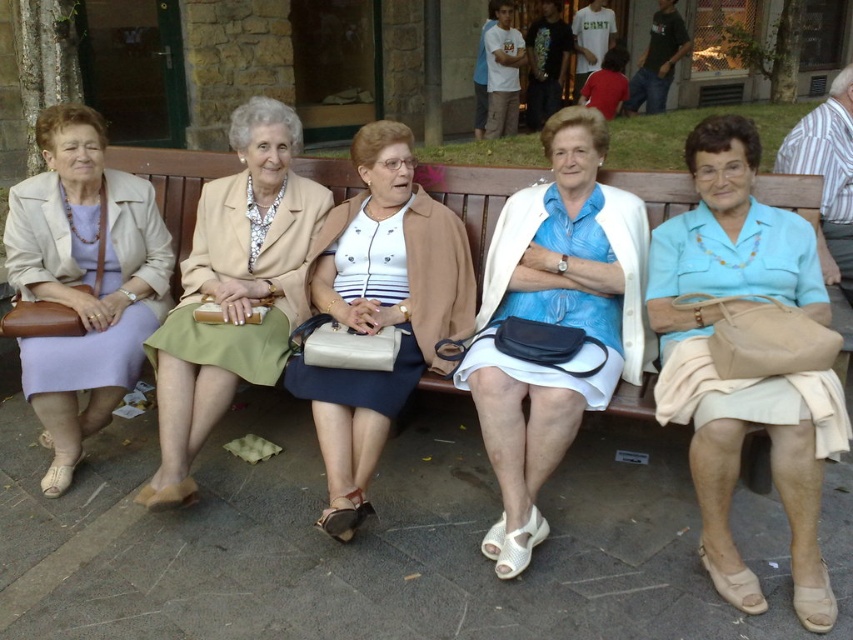
Question: Which point appears farthest from the camera in this image?

Choices:
 (A) (631, 344)
 (B) (169, 440)

Answer: (A)

Question: Which point appears farthest from the camera in this image?

Choices:
 (A) (397, 356)
 (B) (200, 236)
 (C) (515, 524)

Answer: (B)

Question: Which point is closer to the camera taking this photo?

Choices:
 (A) (260, 250)
 (B) (448, 387)
 (C) (393, 163)

Answer: (B)

Question: Can you confirm if light blue fabric dress at center is thinner than matte purple skirt at left?

Choices:
 (A) no
 (B) yes

Answer: (A)

Question: Is light blue fabric dress at center smaller than brown wooden bench at center?

Choices:
 (A) no
 (B) yes

Answer: (A)

Question: From the image, what is the correct spatial relationship of matte purple skirt at left in relation to matte beige blazer at center?

Choices:
 (A) above
 (B) below

Answer: (A)